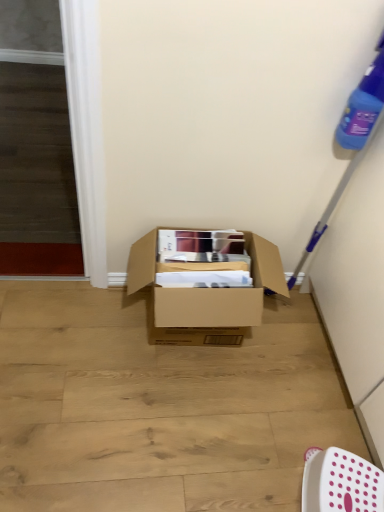
At what (x,y) coordinates should I click in order to perform the action: click on free space above white plastic chair at lower right (from a real-world perspective). Please return your answer as a coordinate pair (x, y). Looking at the image, I should click on (355, 481).